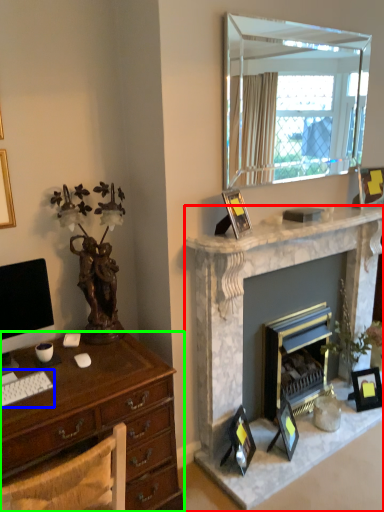
Question: Based on their relative distances, which object is farther from fireplace (highlighted by a red box)? Choose from computer keyboard (highlighted by a blue box) and desk (highlighted by a green box).

Choices:
 (A) computer keyboard
 (B) desk

Answer: (A)